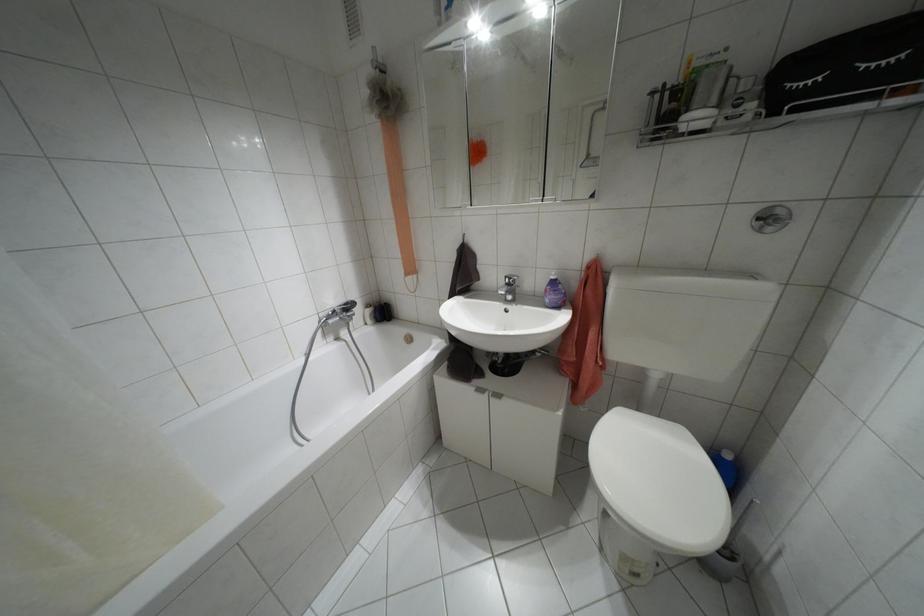
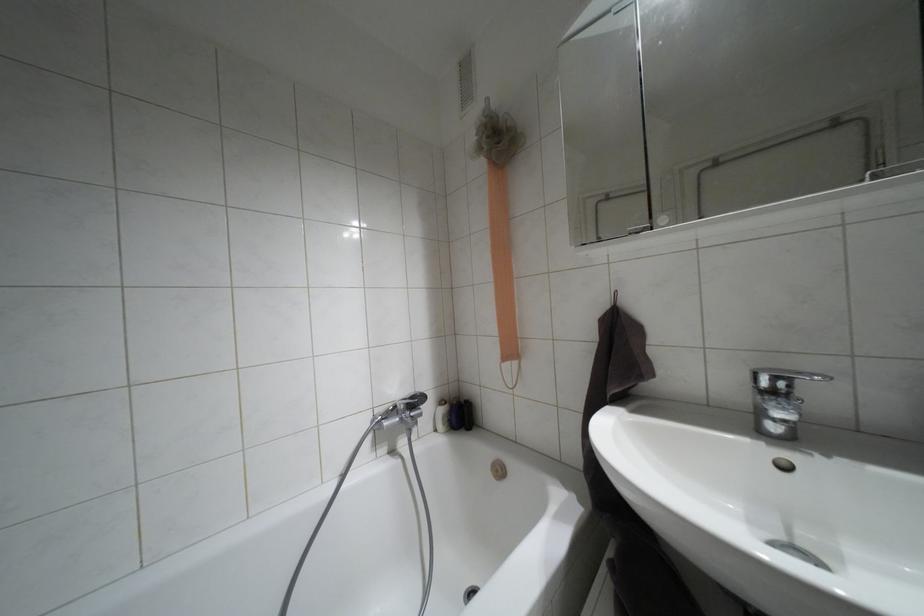
Based on the continuous images, in which direction is the camera rotating?

The rotation direction of the camera is left-up.